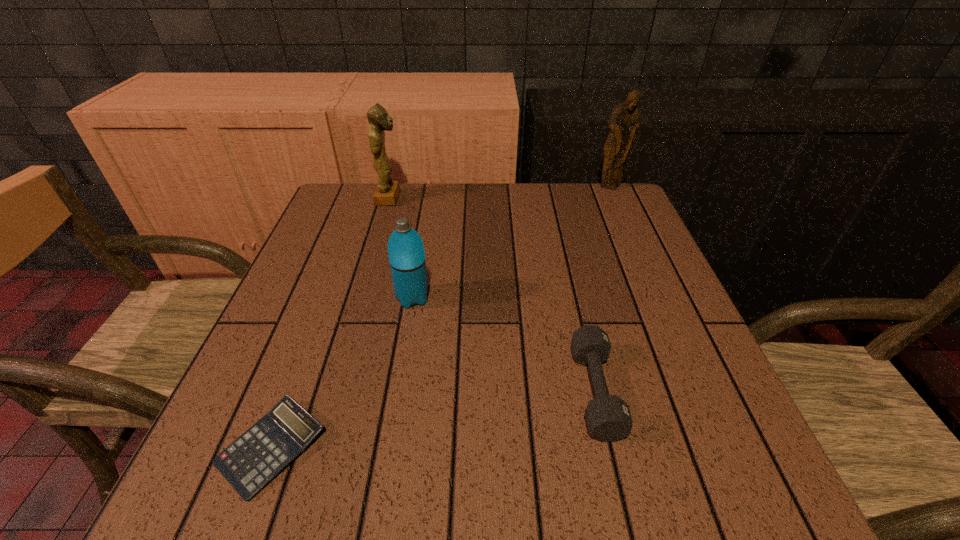
This screenshot has width=960, height=540. In order to click on free space located 0.050m on the back of the second shortest object in this screenshot , I will do `click(581, 327)`.

This screenshot has width=960, height=540. In order to click on vacant area situated 0.350m on the back of the calculator in this screenshot , I will do [340, 266].

What are the coordinates of `object that is at the near edge` in the screenshot? It's located at (249, 463).

I want to click on figurine that is at the left edge, so click(387, 191).

You are a GUI agent. You are given a task and a screenshot of the screen. Output one action in this format:
    pyautogui.click(x=<x>, y=<y>)
    Task: Click on the calculator that is positioned at the left edge
    
    Given the screenshot: What is the action you would take?
    pyautogui.click(x=249, y=463)

The image size is (960, 540). I want to click on object at the right edge, so click(x=623, y=125).

At what (x,y) coordinates should I click in order to perform the action: click on object that is at the far left corner. Please return your answer as a coordinate pair (x, y). The height and width of the screenshot is (540, 960). Looking at the image, I should click on 387,191.

The image size is (960, 540). What are the coordinates of `object situated at the near left corner` in the screenshot? It's located at (249, 463).

At what (x,y) coordinates should I click in order to perform the action: click on object that is at the far right corner. Please return your answer as a coordinate pair (x, y). The image size is (960, 540). Looking at the image, I should click on (623, 125).

The width and height of the screenshot is (960, 540). Identify the location of vacant area at the far edge. [555, 223].